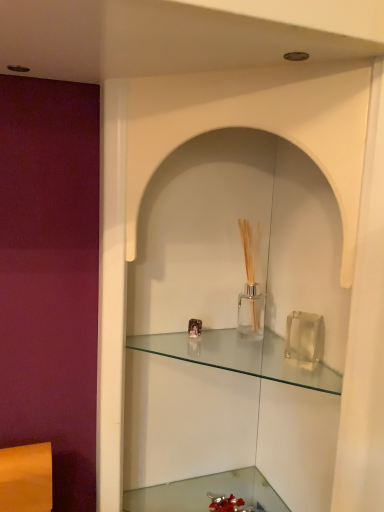
Question: Is clear glass shelf at center at the left side of clear glass vase at lower center?

Choices:
 (A) no
 (B) yes

Answer: (A)

Question: Could you tell me if clear glass shelf at center is facing clear glass vase at lower center?

Choices:
 (A) no
 (B) yes

Answer: (A)

Question: Is clear glass shelf at center not close to clear glass vase at lower center?

Choices:
 (A) yes
 (B) no

Answer: (B)

Question: Is clear glass shelf at center directly adjacent to clear glass vase at lower center?

Choices:
 (A) yes
 (B) no

Answer: (B)

Question: Does clear glass shelf at center have a greater height compared to clear glass vase at lower center?

Choices:
 (A) no
 (B) yes

Answer: (A)

Question: Can you confirm if clear glass shelf at center is bigger than clear glass vase at lower center?

Choices:
 (A) yes
 (B) no

Answer: (B)

Question: Can you see clear glass vase at lower center touching clear glass shelf at center?

Choices:
 (A) no
 (B) yes

Answer: (A)

Question: Is the depth of clear glass vase at lower center less than that of clear glass shelf at center?

Choices:
 (A) no
 (B) yes

Answer: (A)

Question: From a real-world perspective, is clear glass vase at lower center located beneath clear glass shelf at center?

Choices:
 (A) yes
 (B) no

Answer: (A)

Question: Considering the relative sizes of clear glass vase at lower center and clear glass shelf at center in the image provided, is clear glass vase at lower center wider than clear glass shelf at center?

Choices:
 (A) no
 (B) yes

Answer: (B)

Question: Can we say clear glass vase at lower center lies outside clear glass shelf at center?

Choices:
 (A) yes
 (B) no

Answer: (A)

Question: Would you say clear glass vase at lower center contains clear glass shelf at center?

Choices:
 (A) no
 (B) yes

Answer: (A)

Question: Is clear glass shelf at center inside or outside of clear glass vase at lower center?

Choices:
 (A) inside
 (B) outside

Answer: (B)